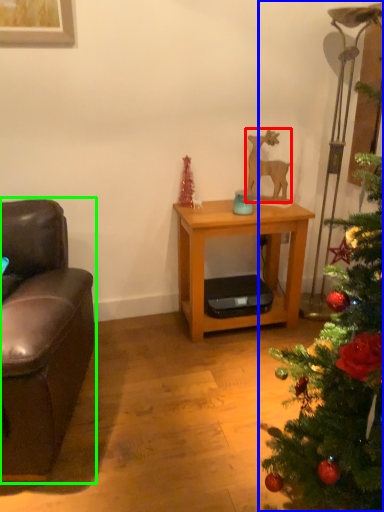
Question: Estimate the real-world distances between objects in this image. Which object is closer to animal (highlighted by a red box), christmas tree (highlighted by a blue box) or studio couch (highlighted by a green box)?

Choices:
 (A) christmas tree
 (B) studio couch

Answer: (A)